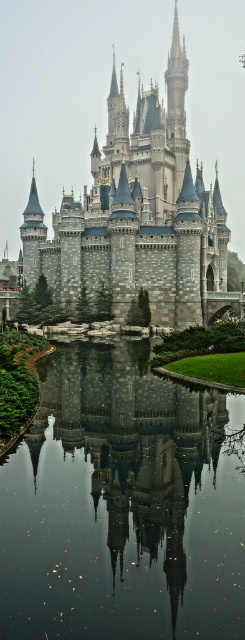
Can you confirm if transparent glass lake at center is taller than stone castle at center?

No, transparent glass lake at center is not taller than stone castle at center.

Which is behind, point (25, 611) or point (218, 196)?

Positioned behind is point (218, 196).

Locate an element on the screen. transparent glass lake at center is located at coordinates (122, 504).

At what (x,y) coordinates should I click in order to perform the action: click on transparent glass lake at center. Please return your answer as a coordinate pair (x, y). The image size is (245, 640). Looking at the image, I should click on (122, 504).